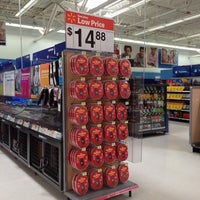
In order to click on floor in this screenshot , I will do `click(163, 145)`.